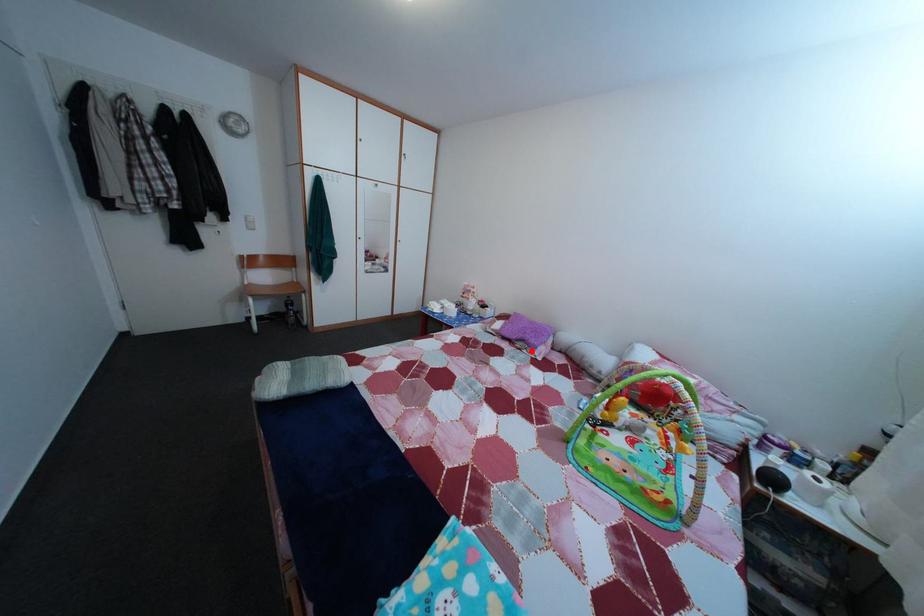
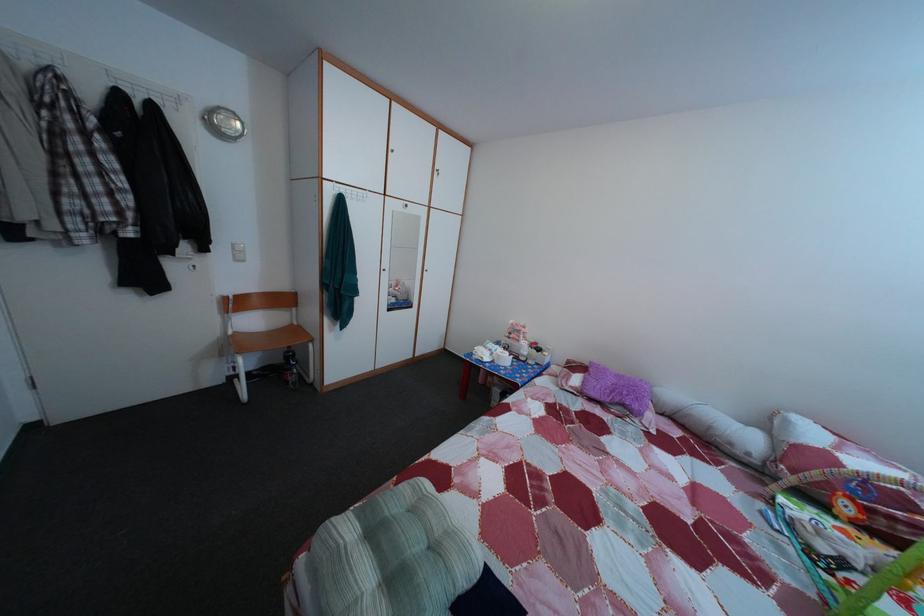
Where in the second image is the point corresponding to the highlighted location from the first image?

(628, 416)